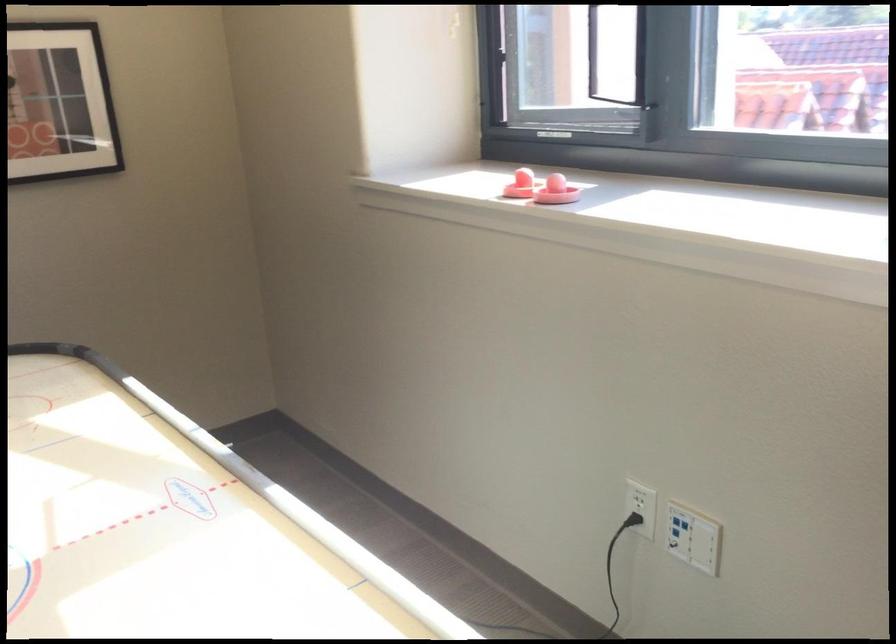
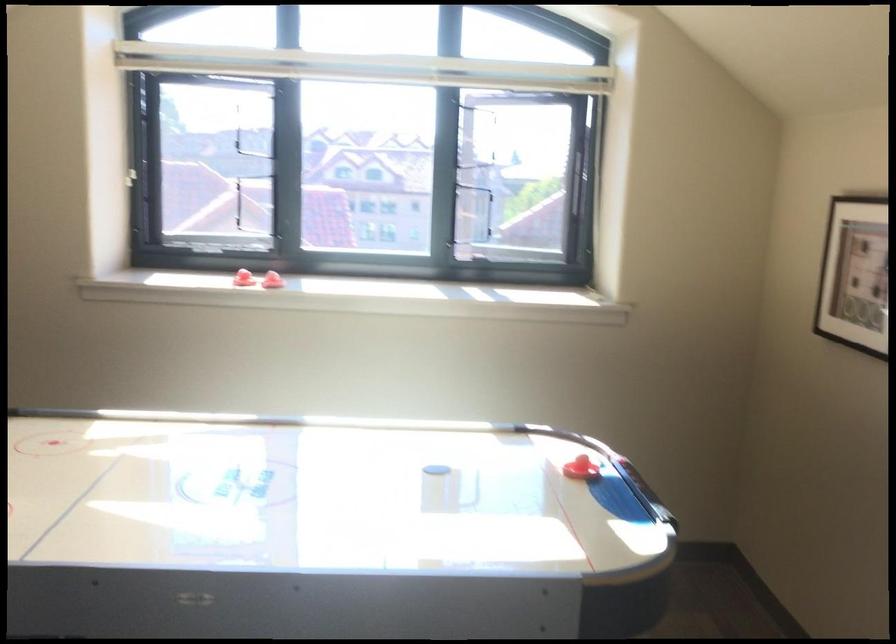
Locate, in the second image, the point that corresponds to (515,192) in the first image.

(244, 279)